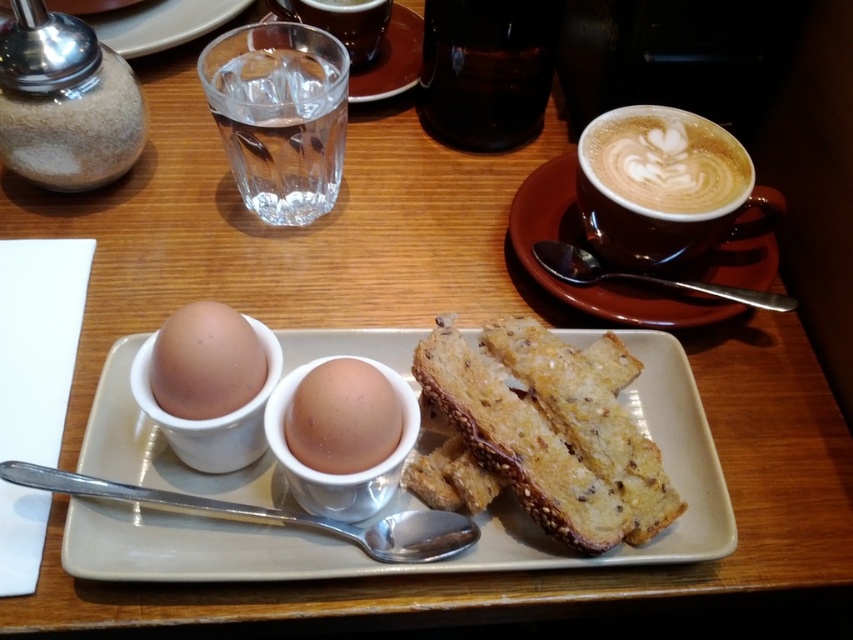
Question: Is dark glass bottle at upper center wider than brown matte egg at center?

Choices:
 (A) no
 (B) yes

Answer: (B)

Question: Considering the real-world distances, which object is closest to the golden brown toasted bread at center?

Choices:
 (A) dark glass bottle at upper center
 (B) transparent glass saucer at upper center
 (C) transparent glass of water at upper left
 (D) brown ceramic saucer at upper right

Answer: (D)

Question: Is white ceramic platter at center to the right of transparent glass of water at upper left from the viewer's perspective?

Choices:
 (A) no
 (B) yes

Answer: (B)

Question: Which point is closer to the camera taking this photo?

Choices:
 (A) (334, 51)
 (B) (538, 19)

Answer: (A)

Question: Which object is positioned farthest from the transparent glass saucer at upper center?

Choices:
 (A) transparent glass of water at upper left
 (B) latte art foam at upper right
 (C) white ceramic platter at center
 (D) dark glass bottle at upper center

Answer: (C)

Question: Considering the relative positions of transparent glass of water at upper left and latte art foam at upper right in the image provided, where is transparent glass of water at upper left located with respect to latte art foam at upper right?

Choices:
 (A) right
 (B) left

Answer: (B)